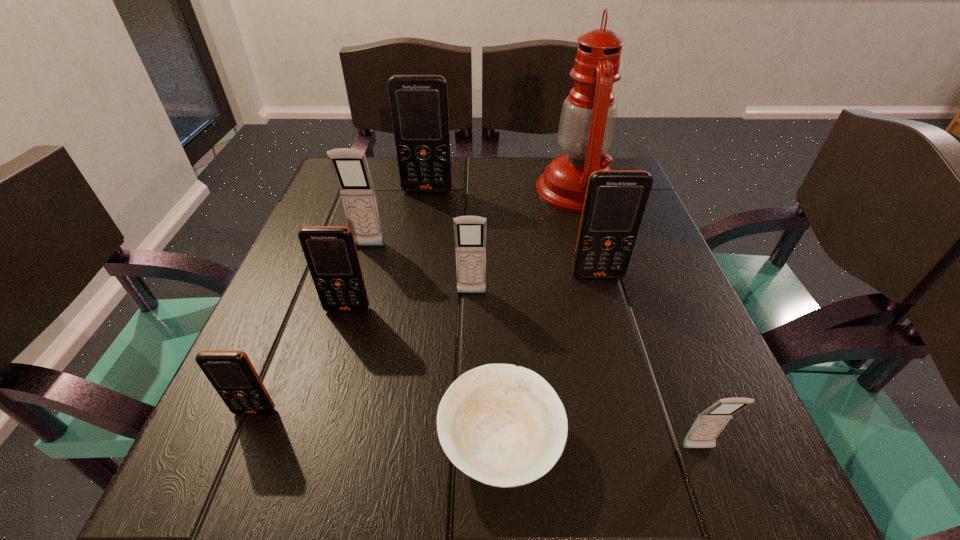
Image resolution: width=960 pixels, height=540 pixels. In order to click on object at the far right corner in this screenshot , I will do `click(588, 117)`.

Locate an element on the screen. The height and width of the screenshot is (540, 960). object that is positioned at the near right corner is located at coordinates (709, 424).

Image resolution: width=960 pixels, height=540 pixels. In the image, there is a desktop. Find the location of `vacant space at the far edge`. vacant space at the far edge is located at coordinates (464, 180).

In the image, there is a desktop. Identify the location of vacant space at the left edge. (318, 356).

You are a GUI agent. You are given a task and a screenshot of the screen. Output one action in this format:
    pyautogui.click(x=<x>, y=<y>)
    Task: Click on the vacant area at the right edge
    
    Given the screenshot: What is the action you would take?
    pyautogui.click(x=617, y=336)

The width and height of the screenshot is (960, 540). In the image, there is a desktop. Find the location of `blank space at the near left corner`. blank space at the near left corner is located at coordinates (179, 519).

The image size is (960, 540). What are the coordinates of `free space between the second orange cellular telephone from left to right and the second gray cellular telephone from right to left` in the screenshot? It's located at (410, 301).

Locate an element on the screen. vacant area between the leftmost orange cellular telephone and the fourth farthest object is located at coordinates [x=426, y=343].

Find the location of a particular element. unoccupied area between the leftmost gray cellular telephone and the shortest object is located at coordinates (435, 346).

Image resolution: width=960 pixels, height=540 pixels. Find the location of `unoccupied position between the rightmost gray cellular telephone and the fourth farthest object`. unoccupied position between the rightmost gray cellular telephone and the fourth farthest object is located at coordinates (648, 362).